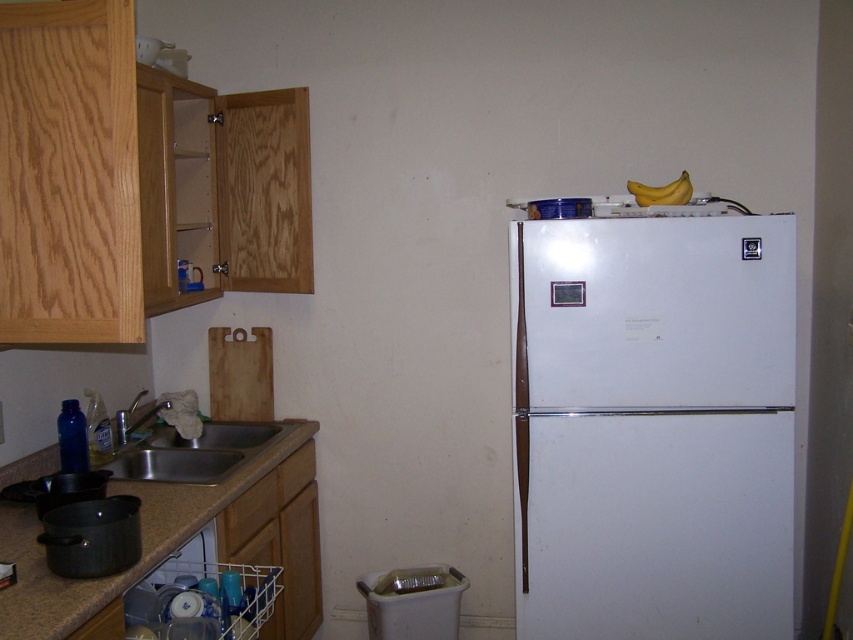
Is white plastic dish washer at lower left positioned before yellow matte bananas at upper right?

Yes, white plastic dish washer at lower left is in front of yellow matte bananas at upper right.

Who is more distant from viewer, (161, 568) or (643, 204)?

Positioned behind is point (643, 204).

The image size is (853, 640). I want to click on white plastic dish washer at lower left, so click(x=207, y=589).

Does point (154, 465) come in front of point (650, 200)?

That is False.

From the picture: Is stainless steel sink at lower left thinner than yellow matte bananas at upper right?

No, stainless steel sink at lower left is not thinner than yellow matte bananas at upper right.

Locate an element on the screen. The height and width of the screenshot is (640, 853). stainless steel sink at lower left is located at coordinates (194, 451).

Is point (717, 268) less distant than point (189, 515)?

No, it is not.

Which is behind, point (642, 401) or point (283, 456)?

The point (283, 456) is behind.

Identify the location of white matte refrigerator at right. (653, 428).